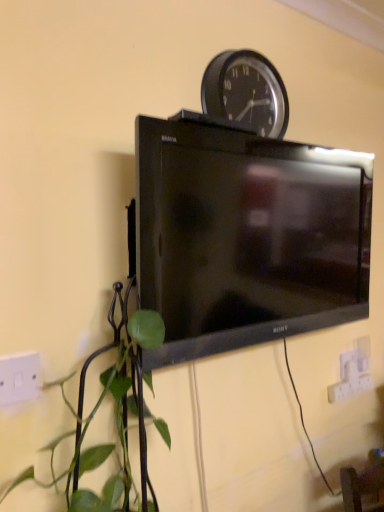
Question: Is black glossy tv at center bigger than white plastic electric outlet at lower right, the 1th electric outlet from the right?

Choices:
 (A) yes
 (B) no

Answer: (A)

Question: From the image's perspective, is black glossy tv at center located above white plastic electric outlet at lower right, arranged as the 2th electric outlet when viewed from the front?

Choices:
 (A) yes
 (B) no

Answer: (A)

Question: Is black glossy tv at center outside white plastic electric outlet at lower right, which ranks as the first electric outlet in bottom-to-top order?

Choices:
 (A) yes
 (B) no

Answer: (A)

Question: Is black glossy tv at center facing away from white plastic electric outlet at lower right, which ranks as the first electric outlet in bottom-to-top order?

Choices:
 (A) no
 (B) yes

Answer: (A)

Question: Can you confirm if black glossy tv at center is positioned to the left of white plastic electric outlet at lower right, which is counted as the 1th electric outlet, starting from the back?

Choices:
 (A) no
 (B) yes

Answer: (B)

Question: Based on their positions, is black plastic wall clock at upper center located to the left or right of white plastic electric outlet at lower right, which is counted as the second electric outlet, starting from the top?

Choices:
 (A) left
 (B) right

Answer: (A)

Question: In the image, is black plastic wall clock at upper center positioned in front of or behind white plastic electric outlet at lower right, which is counted as the second electric outlet, starting from the top?

Choices:
 (A) behind
 (B) front

Answer: (B)

Question: Does point (228, 55) appear closer or farther from the camera than point (349, 365)?

Choices:
 (A) closer
 (B) farther

Answer: (A)

Question: From a real-world perspective, is black plastic wall clock at upper center physically located above or below white plastic electric outlet at lower right, the 1th electric outlet from the right?

Choices:
 (A) below
 (B) above

Answer: (B)

Question: Choose the correct answer: Is white plastic electric outlet at lower right, which is the 2th electric outlet from left to right, inside black plastic wall clock at upper center or outside it?

Choices:
 (A) outside
 (B) inside

Answer: (A)

Question: Is white plastic electric outlet at lower right, which is the 2th electric outlet from left to right, to the left or to the right of black plastic wall clock at upper center in the image?

Choices:
 (A) right
 (B) left

Answer: (A)

Question: Does point pyautogui.click(x=350, y=356) appear closer or farther from the camera than point pyautogui.click(x=246, y=66)?

Choices:
 (A) closer
 (B) farther

Answer: (B)

Question: From a real-world perspective, is white plastic electric outlet at lower right, which is counted as the 1th electric outlet, starting from the back, positioned above or below black plastic wall clock at upper center?

Choices:
 (A) above
 (B) below

Answer: (B)

Question: Is black glossy tv at center wider or thinner than white plastic electric outlet at lower right, which is counted as the 1th electric outlet, starting from the back?

Choices:
 (A) thin
 (B) wide

Answer: (B)

Question: Considering the positions of point (188, 181) and point (365, 344), is point (188, 181) closer or farther from the camera than point (365, 344)?

Choices:
 (A) farther
 (B) closer

Answer: (B)